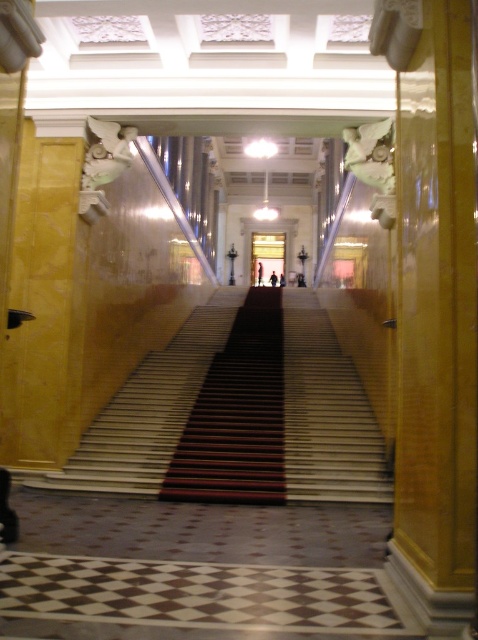
Who is more forward, (174,412) or (228,371)?

Point (174,412)

Does polished marble stairs at center lie behind wooden polished stairs at center?

Yes, it is.

Which is behind, point (138, 426) or point (228, 470)?

The point (138, 426) is behind.

Where is `polished marble stairs at center`? The image size is (478, 640). polished marble stairs at center is located at coordinates (326, 413).